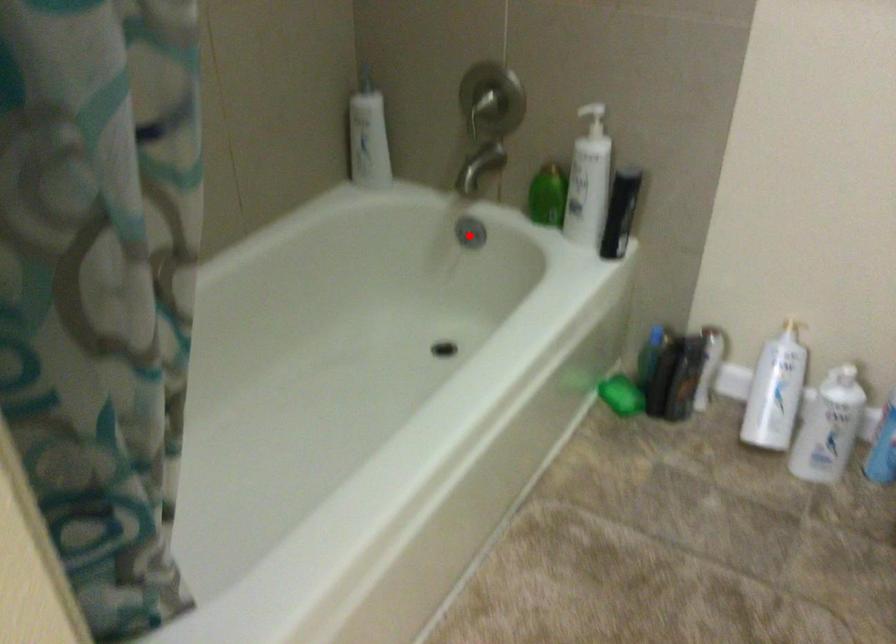
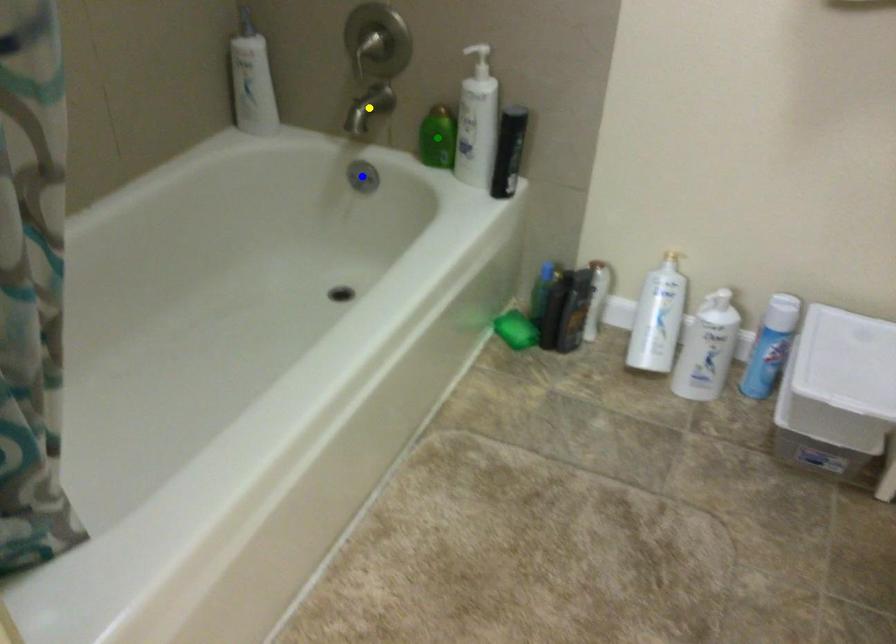
Question: I am providing you with two images of the same scene from different viewpoints. A red point is marked on the first image. You are given multiple points on the second image. Which mark in image 2 goes with the point in image 1?

Choices:
 (A) yellow point
 (B) blue point
 (C) green point

Answer: (B)